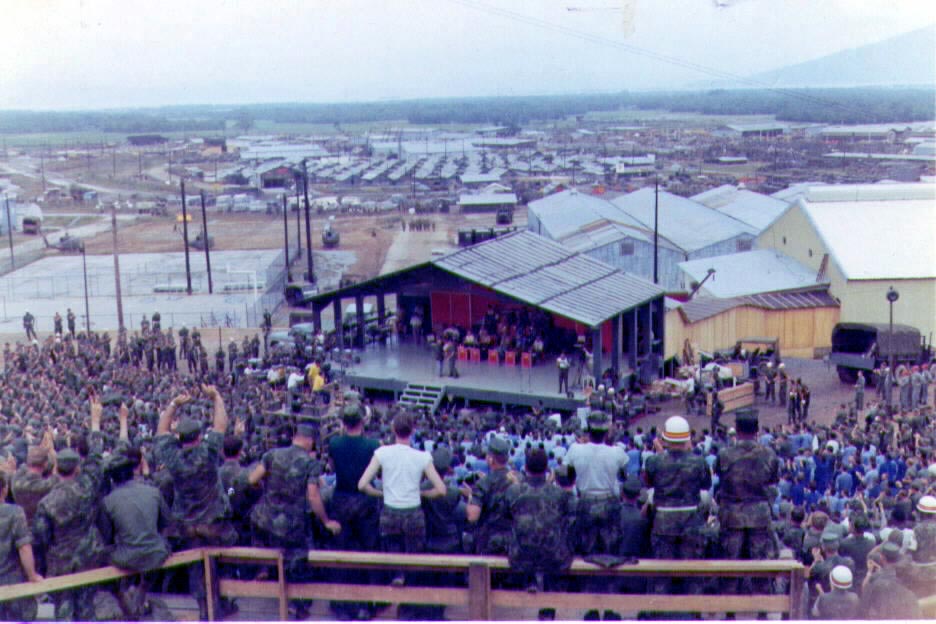
Find the location of a particular element. This screenshot has height=624, width=936. concrete floor is located at coordinates 61,274.